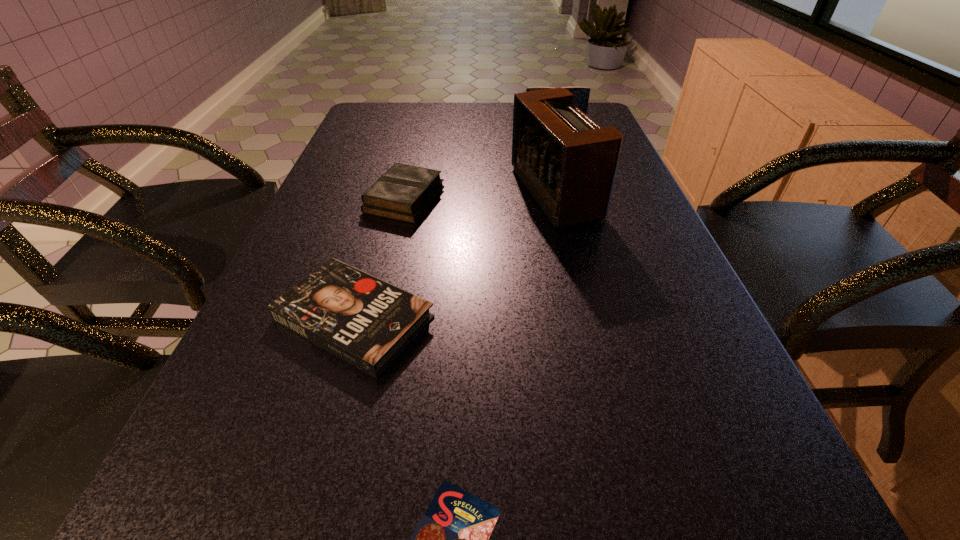
Find the location of `vacant point located on the front of the shortest book`. vacant point located on the front of the shortest book is located at coordinates (319, 442).

Where is `object that is at the far edge`? object that is at the far edge is located at coordinates (581, 94).

This screenshot has height=540, width=960. I want to click on radio receiver positioned at the right edge, so click(x=568, y=163).

Locate an element on the screen. book at the right edge is located at coordinates (581, 94).

Locate an element on the screen. The width and height of the screenshot is (960, 540). object that is at the far right corner is located at coordinates (581, 94).

The height and width of the screenshot is (540, 960). Find the location of `vacant position at the far edge of the desktop`. vacant position at the far edge of the desktop is located at coordinates (445, 113).

At what (x,y) coordinates should I click in order to perform the action: click on free spot at the left edge of the desktop. Please return your answer as a coordinate pair (x, y). This screenshot has width=960, height=540. Looking at the image, I should click on (372, 134).

Find the location of a particular element. vacant space at the right edge is located at coordinates (679, 529).

This screenshot has height=540, width=960. Find the location of `free space between the third tallest object and the farthest book`. free space between the third tallest object and the farthest book is located at coordinates (479, 164).

The image size is (960, 540). Identify the location of free space between the farthest book and the shortest book. (454, 224).